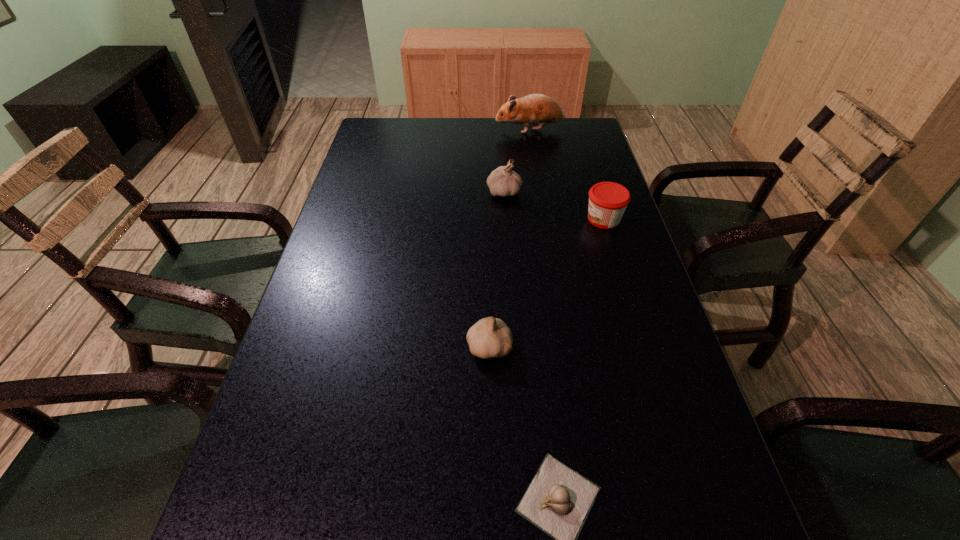
Locate an element on the screen. The width and height of the screenshot is (960, 540). vacant space at the right edge is located at coordinates (594, 288).

This screenshot has height=540, width=960. I want to click on blank area at the far left corner, so click(x=371, y=147).

In the image, there is a desktop. Identify the location of free region at the far right corner. (550, 141).

You are a GUI agent. You are given a task and a screenshot of the screen. Output one action in this format:
    pyautogui.click(x=<x>, y=<y>)
    Task: Click on the vacant area between the fourth farthest object and the farthest garlic
    
    Given the screenshot: What is the action you would take?
    (496, 269)

This screenshot has width=960, height=540. Find the location of `vacant area that lies between the tallest garlic and the third nearest object`. vacant area that lies between the tallest garlic and the third nearest object is located at coordinates (554, 206).

Where is `free area in between the tallest garlic and the third farthest object`? free area in between the tallest garlic and the third farthest object is located at coordinates (554, 206).

Locate which object ranks fourth in proximity to the tallest garlic. Please provide its 2D coordinates. Your answer should be formatted as a tuple, i.e. [(x, y)], where the tuple contains the x and y coordinates of a point satisfying the conditions above.

[(558, 500)]

Select which object is the third closest to the shortest object. Please provide its 2D coordinates. Your answer should be formatted as a tuple, i.e. [(x, y)], where the tuple contains the x and y coordinates of a point satisfying the conditions above.

[(503, 181)]

The image size is (960, 540). Identify the location of the second closest garlic to the second shortest garlic. (503, 181).

Identify which garlic is located as the third nearest to the hamster. Please provide its 2D coordinates. Your answer should be formatted as a tuple, i.e. [(x, y)], where the tuple contains the x and y coordinates of a point satisfying the conditions above.

[(558, 500)]